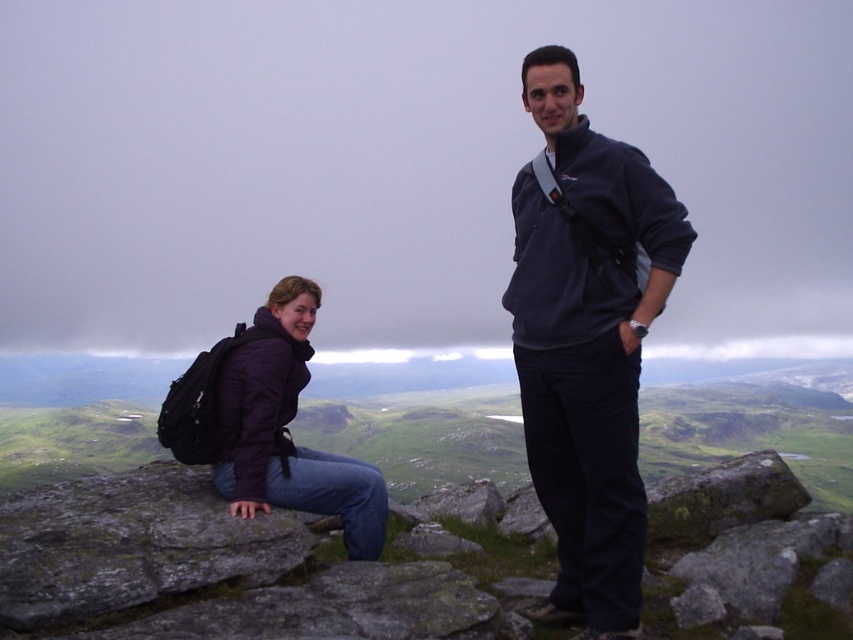
Which is behind, point (618, 163) or point (288, 365)?

Point (288, 365)

Is purple softshell jacket at upper center taller than matte purple jacket at left?

Yes, purple softshell jacket at upper center is taller than matte purple jacket at left.

Is point (579, 320) less distant than point (306, 296)?

That is True.

Locate an element on the screen. This screenshot has width=853, height=640. purple softshell jacket at upper center is located at coordinates (585, 339).

Can you confirm if navy fleece jacket at center is taller than matte purple jacket at left?

Indeed, navy fleece jacket at center has a greater height compared to matte purple jacket at left.

Does point (618, 292) come behind point (260, 352)?

No, it is not.

Describe the element at coordinates (585, 340) in the screenshot. This screenshot has width=853, height=640. I see `navy fleece jacket at center` at that location.

You are a GUI agent. You are given a task and a screenshot of the screen. Output one action in this format:
    pyautogui.click(x=<x>, y=<y>)
    Task: Click on the navy fleece jacket at center
    This screenshot has height=640, width=853.
    Given the screenshot: What is the action you would take?
    pyautogui.click(x=585, y=340)

Is point (537, 456) more distant than point (582, 257)?

Yes.

Which is in front, point (225, 477) or point (635, 429)?

Positioned in front is point (635, 429).

Who is more distant from viewer, (610, 179) or (618, 353)?

The point (610, 179) is behind.

Where is `purple softshell jacket at upper center`? purple softshell jacket at upper center is located at coordinates (585, 339).